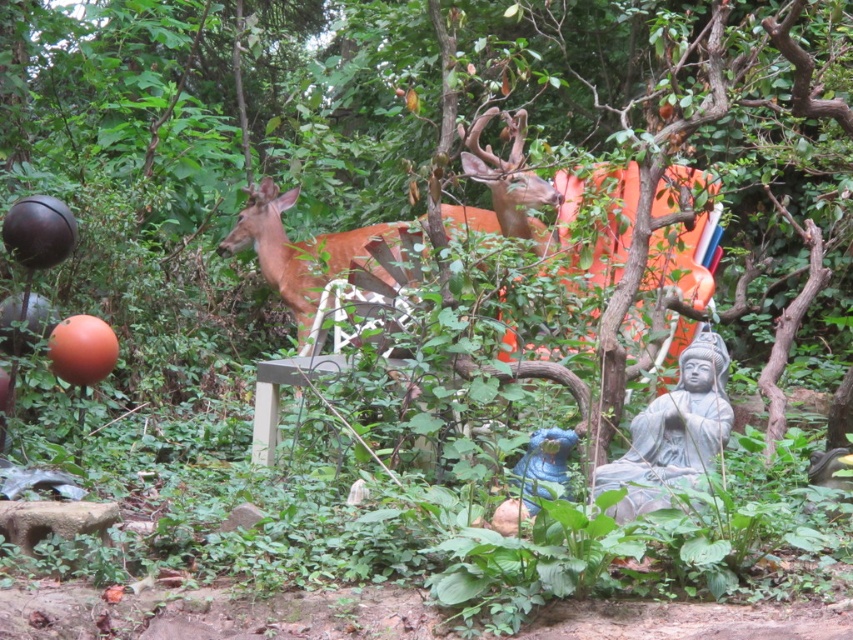
Question: Is gray stone statue at lower right thinner than brown matte/deer at center?

Choices:
 (A) yes
 (B) no

Answer: (A)

Question: Which of the following is the farthest from the observer?

Choices:
 (A) (683, 376)
 (B) (9, 108)
 (C) (469, 212)

Answer: (B)

Question: Which point appears farthest from the camera in this image?

Choices:
 (A) (247, 225)
 (B) (645, 436)

Answer: (A)

Question: Does green leafy tree at center come behind brown matte/deer at center?

Choices:
 (A) yes
 (B) no

Answer: (B)

Question: Does green leafy tree at center have a smaller size compared to brown matte/deer at center?

Choices:
 (A) no
 (B) yes

Answer: (A)

Question: Which point is closer to the camera?

Choices:
 (A) (680, 474)
 (B) (358, 241)

Answer: (A)